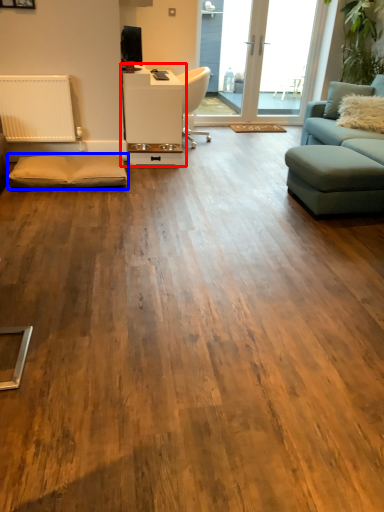
Question: Among these objects, which one is nearest to the camera, table (highlighted by a red box) or footrest (highlighted by a blue box)?

Choices:
 (A) table
 (B) footrest

Answer: (B)